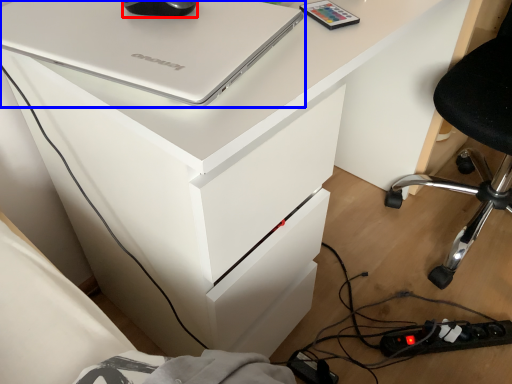
Question: Among these objects, which one is farthest to the camera, mouse (highlighted by a red box) or laptop (highlighted by a blue box)?

Choices:
 (A) mouse
 (B) laptop

Answer: (A)